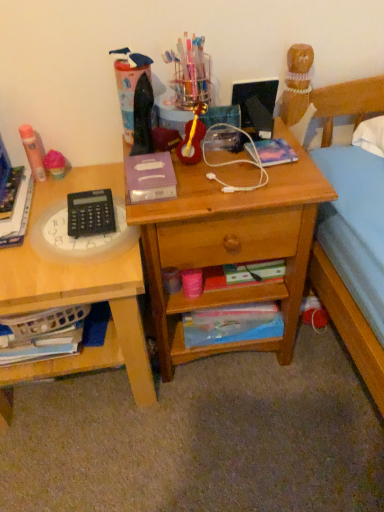
Image resolution: width=384 pixels, height=512 pixels. What are the coordinates of `free point in front of pink fluffy ball at left, which is the second stationery in right-to-left order` in the screenshot? It's located at (44, 198).